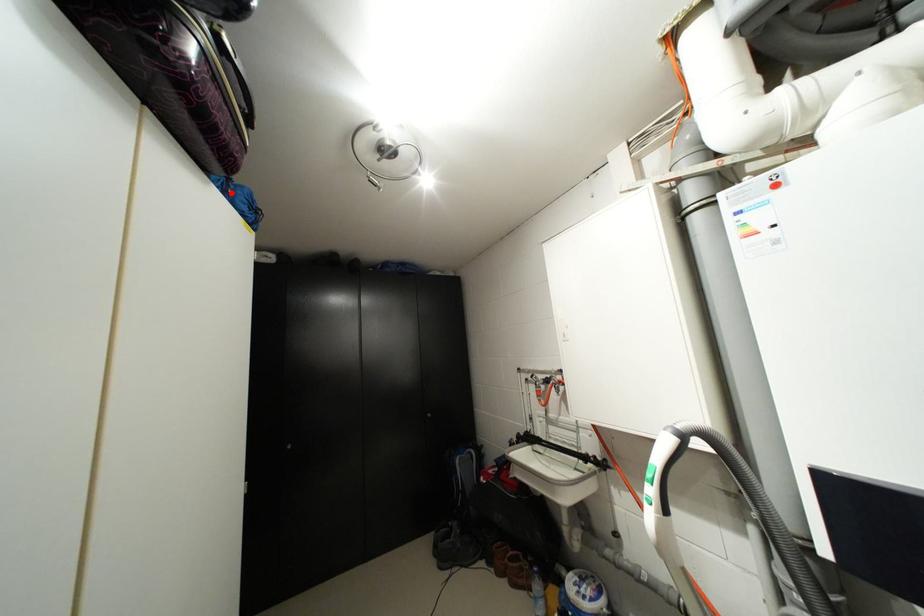
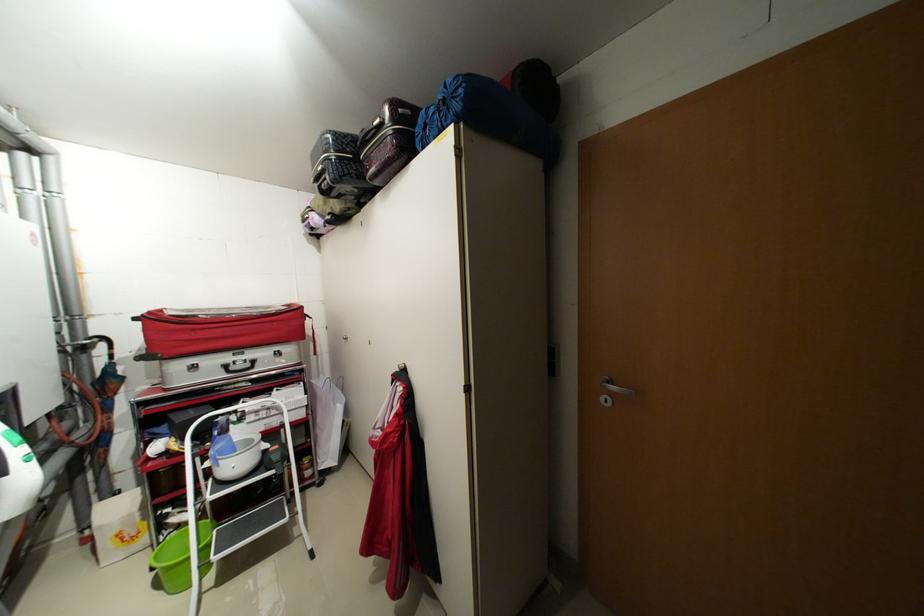
Question: I am providing you with two images of the same scene from different viewpoints. A red point is marked on the first image. Can you still see the location of the red point in image 2?

Choices:
 (A) Yes
 (B) No

Answer: (B)